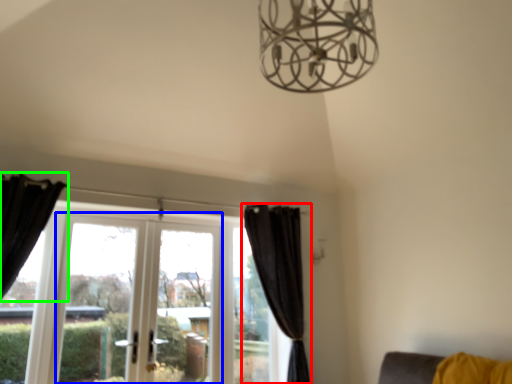
Question: Based on their relative distances, which object is farther from curtain (highlighted by a red box)? Choose from screen door (highlighted by a blue box) and curtain (highlighted by a green box).

Choices:
 (A) screen door
 (B) curtain

Answer: (B)